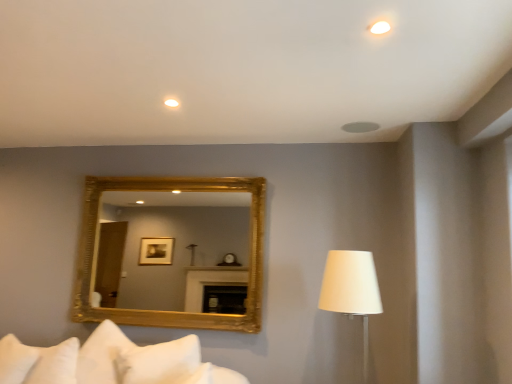
Describe the element at coordinates (15, 360) in the screenshot. The height and width of the screenshot is (384, 512). I see `white soft pillow at lower left, which is counted as the 1th pillow, starting from the left` at that location.

Where is `gold/gilded mirror at center`? The image size is (512, 384). gold/gilded mirror at center is located at coordinates (176, 248).

Which is behind, white matte ceiling light at upper center, placed as the first lighting when sorted from left to right, or white fabric lampshade at right?

white matte ceiling light at upper center, placed as the first lighting when sorted from left to right.

From a real-world perspective, is white matte ceiling light at upper center, positioned as the first lighting in back-to-front order, under white fabric lampshade at right?

No, from a real-world perspective, white matte ceiling light at upper center, positioned as the first lighting in back-to-front order, is not beneath white fabric lampshade at right.

Is white matte ceiling light at upper center, placed as the first lighting when sorted from left to right, oriented away from white fabric lampshade at right?

No, white fabric lampshade at right is not at the back of white matte ceiling light at upper center, placed as the first lighting when sorted from left to right.

Which is more to the right, white matte ceiling light at upper center, the first lighting when ordered from right to left, or white fabric lampshade at right?

From the viewer's perspective, white fabric lampshade at right appears more on the right side.

Based on the photo, from the image's perspective, is white matte ceiling light at upper center, which is the second lighting from back to front, on top of white fabric lampshade at right?

Yes.

In terms of size, does white matte ceiling light at upper center, which is the second lighting from back to front, appear bigger or smaller than white fabric lampshade at right?

Clearly, white matte ceiling light at upper center, which is the second lighting from back to front, is smaller in size than white fabric lampshade at right.

Are white matte ceiling light at upper center, which is the second lighting from back to front, and white fabric lampshade at right making contact?

white matte ceiling light at upper center, which is the second lighting from back to front, and white fabric lampshade at right are clearly separated.

In the scene shown: Is white soft pillow at lower left, which is counted as the 1th pillow, starting from the left, completely or partially outside of white matte ceiling light at upper center, the first lighting when ordered from right to left?

white soft pillow at lower left, which is counted as the 1th pillow, starting from the left, is positioned outside white matte ceiling light at upper center, the first lighting when ordered from right to left.

Which is in front, white soft pillow at lower left, which ranks as the second pillow in right-to-left order, or white matte ceiling light at upper center, arranged as the 2th lighting when ordered from the bottom?

Positioned in front is white matte ceiling light at upper center, arranged as the 2th lighting when ordered from the bottom.

Is white matte ceiling light at upper center, the first lighting from the front, facing towards white matte ceiling light at upper center, positioned as the first lighting in back-to-front order?

No, white matte ceiling light at upper center, the first lighting from the front, is not oriented towards white matte ceiling light at upper center, positioned as the first lighting in back-to-front order.

Is point (388, 25) more distant than point (165, 102)?

No.

Which object is thinner, white matte ceiling light at upper center, which is the second lighting from back to front, or white matte ceiling light at upper center, the first lighting in the bottom-to-top sequence?

With smaller width is white matte ceiling light at upper center, which is the second lighting from back to front.

Considering the relative positions of white matte ceiling light at upper center, the first lighting from the front, and white soft pillow at lower left, which appears as the 2th pillow when viewed from the left, in the image provided, is white matte ceiling light at upper center, the first lighting from the front, to the left or to the right of white soft pillow at lower left, which appears as the 2th pillow when viewed from the left,?

Clearly, white matte ceiling light at upper center, the first lighting from the front, is on the right of white soft pillow at lower left, which appears as the 2th pillow when viewed from the left, in the image.

From a real-world perspective, is white matte ceiling light at upper center, the 2th lighting when ordered from left to right, under white soft pillow at lower left, which is counted as the first pillow, starting from the right?

No, from a real-world perspective, white matte ceiling light at upper center, the 2th lighting when ordered from left to right, is not beneath white soft pillow at lower left, which is counted as the first pillow, starting from the right.

Measure the distance from white matte ceiling light at upper center, the 1th lighting positioned from the top, to white soft pillow at lower left, which is counted as the first pillow, starting from the right.

They are 8.75 feet apart.

Based on the photo, which is correct: white fabric lampshade at right is inside white matte ceiling light at upper center, the first lighting from the front, or outside of it?

white fabric lampshade at right is not enclosed by white matte ceiling light at upper center, the first lighting from the front.

Is the position of white fabric lampshade at right more distant than that of white matte ceiling light at upper center, which is the second lighting from back to front?

Yes, white fabric lampshade at right is further from the camera.

Consider the image. From a real-world perspective, which is physically below, white fabric lampshade at right or white matte ceiling light at upper center, the 1th lighting positioned from the top?

In real-world perspective, white fabric lampshade at right is lower.

Does white fabric lampshade at right have a lesser height compared to white matte ceiling light at upper center, which is the second lighting from back to front?

No.

Considering the positions of objects white soft pillow at lower left, which is counted as the first pillow, starting from the right, and white fabric lampshade at right in the image provided, who is more to the left, white soft pillow at lower left, which is counted as the first pillow, starting from the right, or white fabric lampshade at right?

From the viewer's perspective, white soft pillow at lower left, which is counted as the first pillow, starting from the right, appears more on the left side.

Which point is more forward, (x=57, y=383) or (x=374, y=301)?

Positioned in front is point (x=374, y=301).

From the image's perspective, which is above, white soft pillow at lower left, which is counted as the first pillow, starting from the right, or white fabric lampshade at right?

white fabric lampshade at right.

I want to click on the 1st pillow behind when counting from the white fabric lampshade at right, so click(x=38, y=362).

Find the location of a particular element. lighting that is the 2nd one when counting leftward from the white fabric lampshade at right is located at coordinates (170, 103).

You are a GUI agent. You are given a task and a screenshot of the screen. Output one action in this format:
    pyautogui.click(x=<x>, y=<y>)
    Task: Click on the table lamp on the right of white matte ceiling light at upper center, the 2th lighting when ordered from left to right
    
    Given the screenshot: What is the action you would take?
    pyautogui.click(x=351, y=289)

From the image, which object appears to be farther from white soft pillow at lower left, which is counted as the first pillow, starting from the right, white matte ceiling light at upper center, placed as the first lighting when sorted from left to right, or white matte ceiling light at upper center, the first lighting from the front?

white matte ceiling light at upper center, the first lighting from the front.

From the image, which object appears to be farther from white fabric lampshade at right, gold/gilded mirror at center or white soft pillow at lower left, which is counted as the first pillow, starting from the right?

The object further to white fabric lampshade at right is gold/gilded mirror at center.

Which object lies further to the anchor point gold/gilded mirror at center, white soft pillow at lower left, which ranks as the second pillow in right-to-left order, or white fabric lampshade at right?

Among the two, white fabric lampshade at right is located further to gold/gilded mirror at center.

Based on their spatial positions, is white soft pillow at lower left, which appears as the 2th pillow when viewed from the left, or white matte ceiling light at upper center, which is the second lighting from back to front, further from white fabric lampshade at right?

The object further to white fabric lampshade at right is white soft pillow at lower left, which appears as the 2th pillow when viewed from the left.

From the image, which object appears to be farther from white soft pillow at lower left, which appears as the 2th pillow when viewed from the left, white matte ceiling light at upper center, which is the second lighting from back to front, or white soft pillow at lower left, which is counted as the 1th pillow, starting from the left?

Among the two, white matte ceiling light at upper center, which is the second lighting from back to front, is located further to white soft pillow at lower left, which appears as the 2th pillow when viewed from the left.

Which object lies further to the anchor point white fabric lampshade at right, white matte ceiling light at upper center, the second lighting positioned from the front, or gold/gilded mirror at center?

Answer: The object further to white fabric lampshade at right is gold/gilded mirror at center.

Considering their positions, is white matte ceiling light at upper center, arranged as the 2th lighting when ordered from the bottom, positioned further to white soft pillow at lower left, which ranks as the second pillow in right-to-left order, than white soft pillow at lower left, which appears as the 2th pillow when viewed from the left?

white matte ceiling light at upper center, arranged as the 2th lighting when ordered from the bottom, is further to white soft pillow at lower left, which ranks as the second pillow in right-to-left order.

Considering their positions, is gold/gilded mirror at center positioned closer to white matte ceiling light at upper center, the second lighting positioned from the front, than white soft pillow at lower left, which is counted as the first pillow, starting from the right?

white soft pillow at lower left, which is counted as the first pillow, starting from the right, is positioned closer to the anchor white matte ceiling light at upper center, the second lighting positioned from the front.

Where is `mirror between white matte ceiling light at upper center, the second lighting positioned from the front, and white soft pillow at lower left, which is counted as the first pillow, starting from the right, vertically`? The image size is (512, 384). mirror between white matte ceiling light at upper center, the second lighting positioned from the front, and white soft pillow at lower left, which is counted as the first pillow, starting from the right, vertically is located at coordinates (176, 248).

Locate an element on the screen. This screenshot has width=512, height=384. mirror between white matte ceiling light at upper center, marked as the 2th lighting in a right-to-left arrangement, and white fabric lampshade at right from top to bottom is located at coordinates (176, 248).

At what (x,y) coordinates should I click in order to perform the action: click on mirror between white soft pillow at lower left, which appears as the 2th pillow when viewed from the left, and white fabric lampshade at right. Please return your answer as a coordinate pair (x, y). Image resolution: width=512 pixels, height=384 pixels. Looking at the image, I should click on (176, 248).

Identify the location of pillow between white soft pillow at lower left, which is counted as the 1th pillow, starting from the left, and white fabric lampshade at right. Image resolution: width=512 pixels, height=384 pixels. (38, 362).